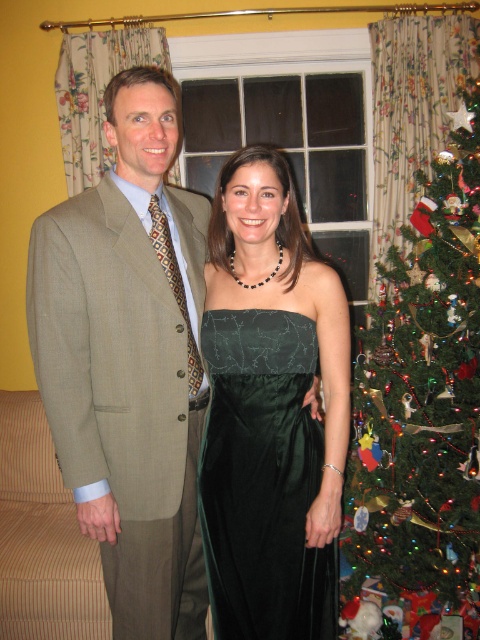
Does velvet green dress at center appear under satin dark green dress at center?

No, velvet green dress at center is not below satin dark green dress at center.

Is the position of velvet green dress at center more distant than that of satin dark green dress at center?

No, it is not.

You are a GUI agent. You are given a task and a screenshot of the screen. Output one action in this format:
    pyautogui.click(x=<x>, y=<y>)
    Task: Click on the velvet green dress at center
    The width and height of the screenshot is (480, 640).
    Given the screenshot: What is the action you would take?
    pyautogui.click(x=129, y=360)

At what (x,y) coordinates should I click in order to perform the action: click on velvet green dress at center. Please return your answer as a coordinate pair (x, y). The image size is (480, 640). Looking at the image, I should click on (129, 360).

Does velvet green dress at center have a smaller size compared to green velvet christmas tree at right?

Indeed, velvet green dress at center has a smaller size compared to green velvet christmas tree at right.

How distant is velvet green dress at center from green velvet christmas tree at right?

velvet green dress at center is 36.71 inches away from green velvet christmas tree at right.

Locate an element on the screen. velvet green dress at center is located at coordinates (129, 360).

At what (x,y) coordinates should I click in order to perform the action: click on green velvet christmas tree at right. Please return your answer as a coordinate pair (x, y). Image resolution: width=480 pixels, height=640 pixels. Looking at the image, I should click on (421, 401).

In the scene shown: Can you confirm if green velvet christmas tree at right is positioned to the left of satin dark green dress at center?

In fact, green velvet christmas tree at right is to the right of satin dark green dress at center.

Which is behind, point (479, 211) or point (249, 625)?

Point (479, 211)

Where is `green velvet christmas tree at right`? green velvet christmas tree at right is located at coordinates (421, 401).